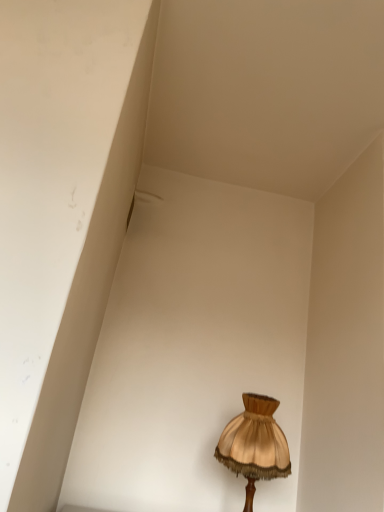
The image size is (384, 512). What are the coordinates of `gold fabric lampshade at lower center` in the screenshot? It's located at (254, 444).

This screenshot has height=512, width=384. What do you see at coordinates (254, 444) in the screenshot?
I see `gold fabric lampshade at lower center` at bounding box center [254, 444].

Find the location of `gold fabric lampshade at lower center`. gold fabric lampshade at lower center is located at coordinates (254, 444).